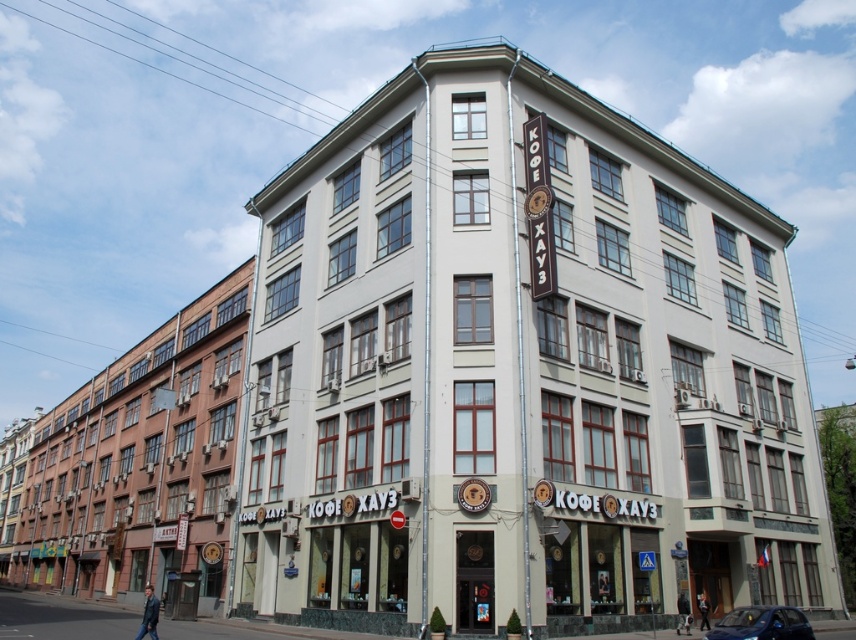
Question: Is white smooth building at center thinner than shiny blue car at lower right?

Choices:
 (A) no
 (B) yes

Answer: (A)

Question: Does matte brown building at left appear under shiny blue car at lower right?

Choices:
 (A) yes
 (B) no

Answer: (A)

Question: Is matte brown building at left smaller than shiny blue car at lower right?

Choices:
 (A) no
 (B) yes

Answer: (A)

Question: Among these points, which one is farthest from the camera?

Choices:
 (A) 669,292
 (B) 76,429

Answer: (B)

Question: Estimate the real-world distances between objects in this image. Which object is farther from the white smooth building at center?

Choices:
 (A) shiny blue car at lower right
 (B) matte brown building at left

Answer: (B)

Question: Based on their relative distances, which object is farther from the shiny blue car at lower right?

Choices:
 (A) white smooth building at center
 (B) matte brown building at left

Answer: (B)